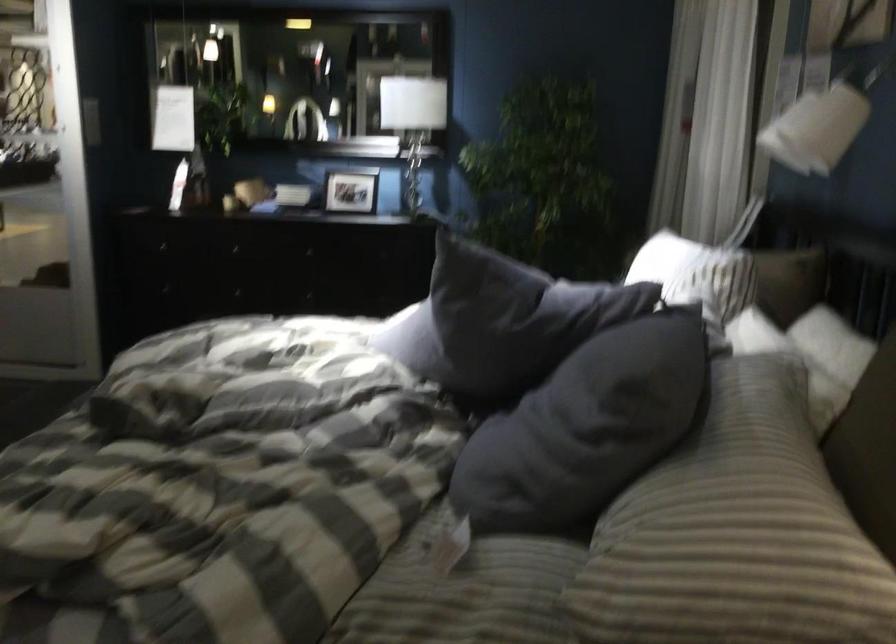
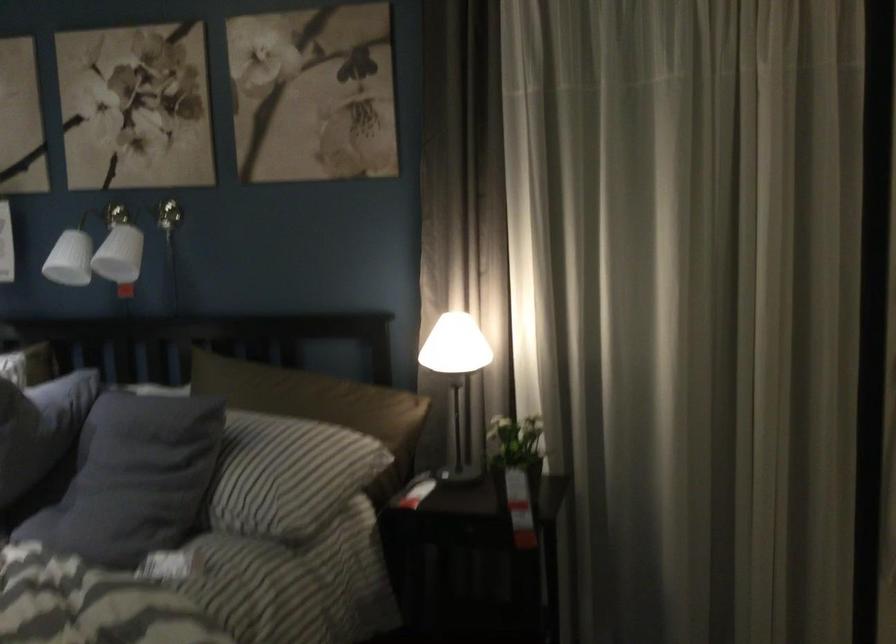
Where in the second image is the point corresponding to (810,108) from the first image?

(125, 245)